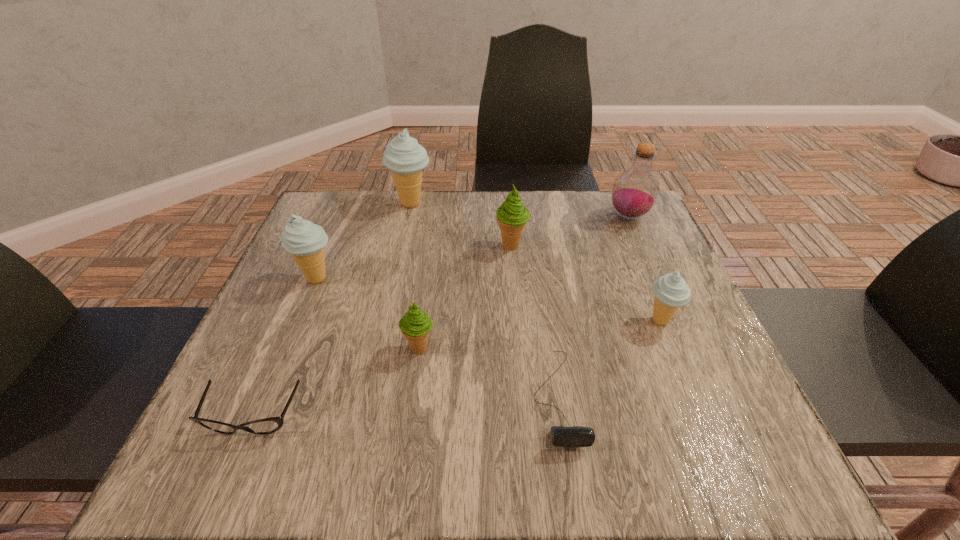
Locate an element on the screen. Image resolution: width=960 pixels, height=540 pixels. the nearest icecream is located at coordinates (415, 325).

At what (x,y) coordinates should I click in order to perform the action: click on spectacles. Please return your answer as a coordinate pair (x, y). Looking at the image, I should click on tap(267, 425).

Locate an element on the screen. This screenshot has height=540, width=960. webcam is located at coordinates (576, 436).

Where is `vacant space positioned on the right of the tallest icecream`? The image size is (960, 540). vacant space positioned on the right of the tallest icecream is located at coordinates pos(451,204).

Where is `free space located 0.310m on the left of the purple bottle`? This screenshot has height=540, width=960. free space located 0.310m on the left of the purple bottle is located at coordinates (490, 217).

Locate an element on the screen. blank area located 0.400m on the front of the fourth icecream from left to right is located at coordinates (525, 406).

The image size is (960, 540). I want to click on free spot located on the front of the second farthest beige icecream, so click(296, 328).

The height and width of the screenshot is (540, 960). I want to click on blank space located 0.070m on the back of the fourth nearest object, so click(645, 285).

What are the coordinates of `free space located 0.180m on the left of the nearest icecream` in the screenshot? It's located at (308, 348).

Locate an element on the screen. This screenshot has width=960, height=540. bottle at the far edge is located at coordinates (635, 191).